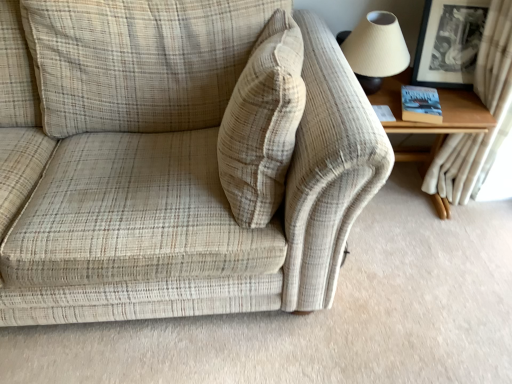
Question: Would you say matte beige lampshade at upper right is to the left or to the right of beige corduroy pillow at center in the picture?

Choices:
 (A) left
 (B) right

Answer: (B)

Question: From their relative heights in the image, would you say matte beige lampshade at upper right is taller or shorter than beige corduroy pillow at center?

Choices:
 (A) tall
 (B) short

Answer: (B)

Question: Which is nearer to the beige corduroy pillow at center?

Choices:
 (A) matte beige lampshade at upper right
 (B) white textured curtain at upper right
 (C) wooden table at right
 (D) beige plaid fabric couch at center
 (E) black glossy picture frame at upper right

Answer: (D)

Question: Which is farther from the beige corduroy pillow at center?

Choices:
 (A) beige plaid fabric couch at center
 (B) matte beige lampshade at upper right
 (C) white textured curtain at upper right
 (D) black glossy picture frame at upper right
 (E) wooden table at right

Answer: (C)